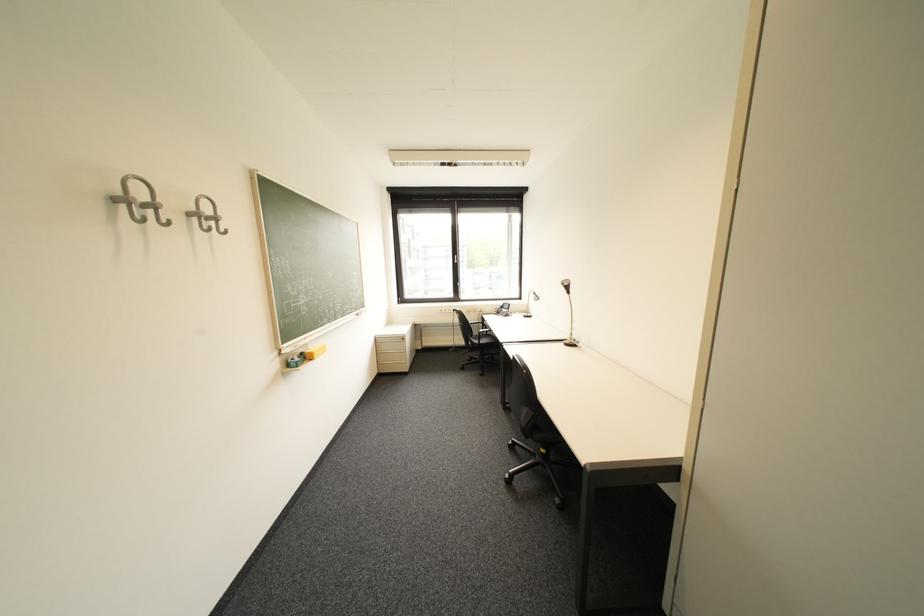
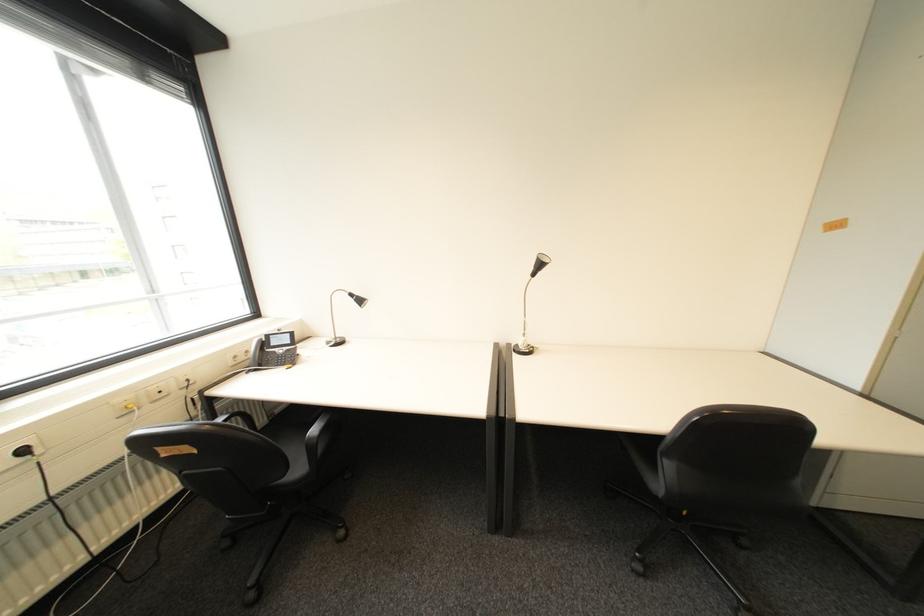
In the second image, find the point that corresponds to pixel 465 310 in the first image.

(34, 452)